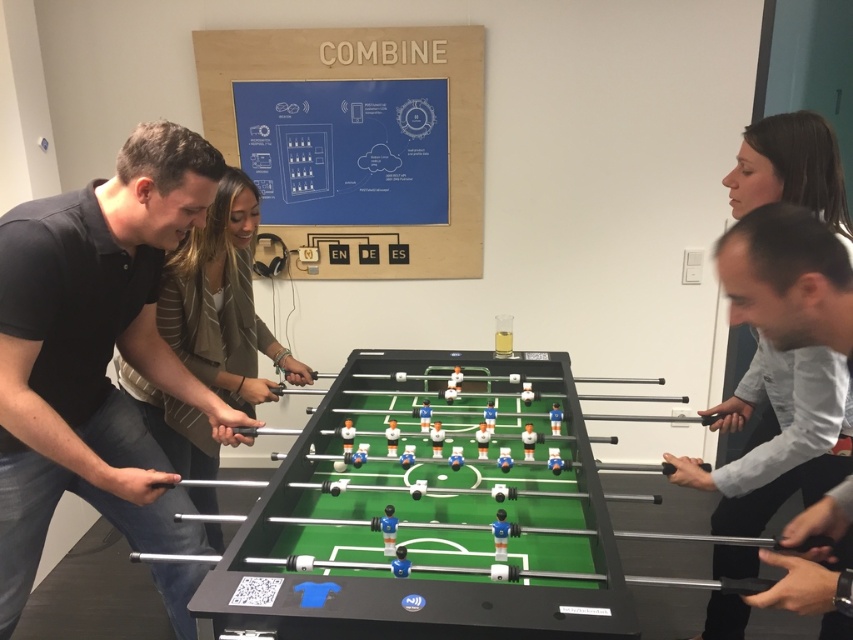
Is green plastic foosball table at center bigger than light gray shirt at right?

No, green plastic foosball table at center is not bigger than light gray shirt at right.

You are a GUI agent. You are given a task and a screenshot of the screen. Output one action in this format:
    pyautogui.click(x=<x>, y=<y>)
    Task: Click on the green plastic foosball table at center
    This screenshot has height=640, width=853.
    Given the screenshot: What is the action you would take?
    pyautogui.click(x=436, y=474)

Does black shirt at left have a lesser width compared to green plastic foosball table at center?

Indeed, black shirt at left has a lesser width compared to green plastic foosball table at center.

Which is more to the left, black shirt at left or green plastic foosball table at center?

black shirt at left is more to the left.

Is point (45, 364) positioned in front of point (426, 442)?

Yes, it is.

Find the location of `black shirt at left`. black shirt at left is located at coordinates (96, 353).

Between black shirt at left and light gray shirt at right, which one is positioned lower?

light gray shirt at right is lower down.

Can you confirm if black shirt at left is smaller than light gray shirt at right?

Correct, black shirt at left occupies less space than light gray shirt at right.

Locate an element on the screen. black shirt at left is located at coordinates (x=96, y=353).